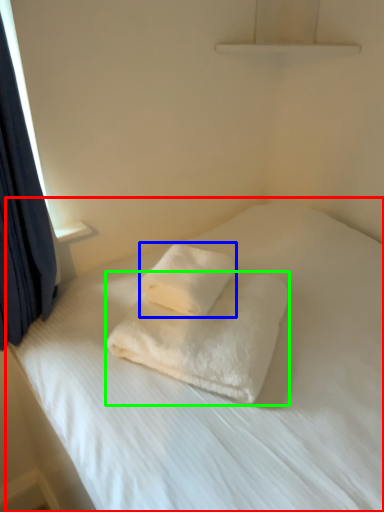
Question: Which object is positioned closest to bed (highlighted by a red box)? Select from towel (highlighted by a blue box) and towel (highlighted by a green box).

Choices:
 (A) towel
 (B) towel

Answer: (B)